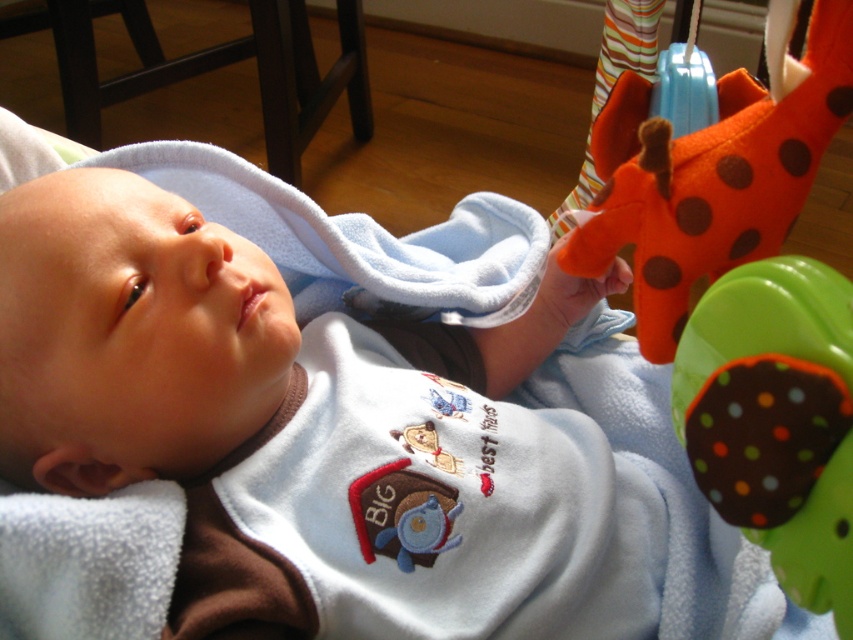
A baby is lying on the soft blue blanket at center and wants to reach the green fabric teether at right. The baby can stretch 10 inches. Can the baby reach the teether?

The distance between the soft blue blanket at center and the green fabric teether at right is 10.90 inches. Since the baby can only stretch 10 inches, the baby cannot reach the teether.

You are a parent holding the green fabric teether at right and the orange felt giraffe at upper right. Which toy is shorter?

The green fabric teether at right is shorter than the orange felt giraffe at upper right.

Where is the soft blue blanket at center located in the image?

The soft blue blanket at center is located at point (x=309, y=432) in the image.